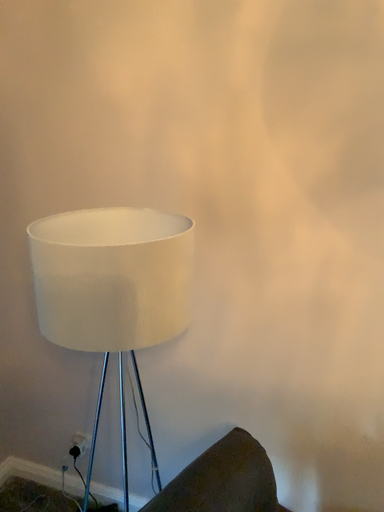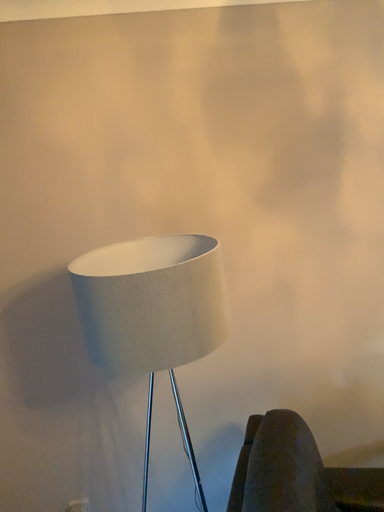
Question: Which way did the camera rotate in the video?

Choices:
 (A) rotated left
 (B) rotated right

Answer: (B)